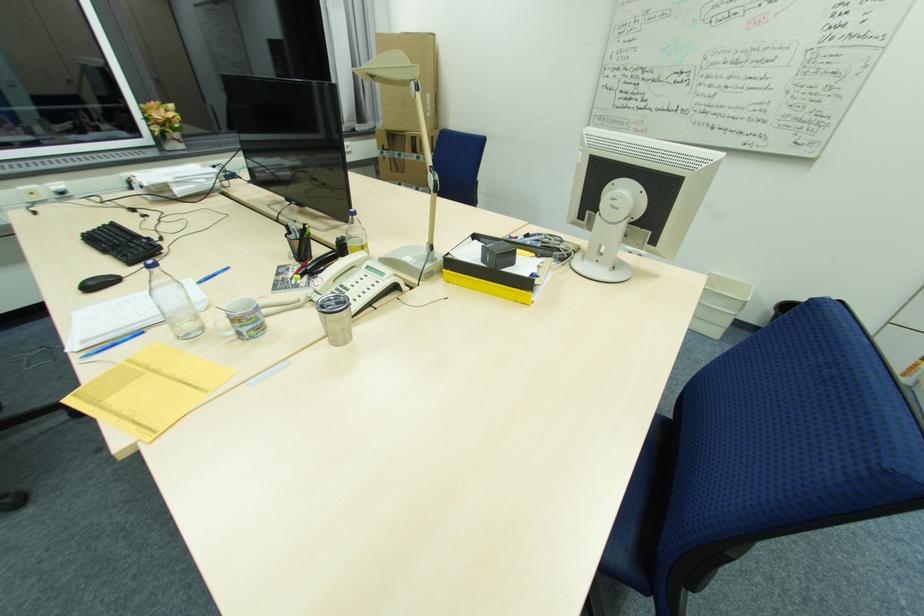
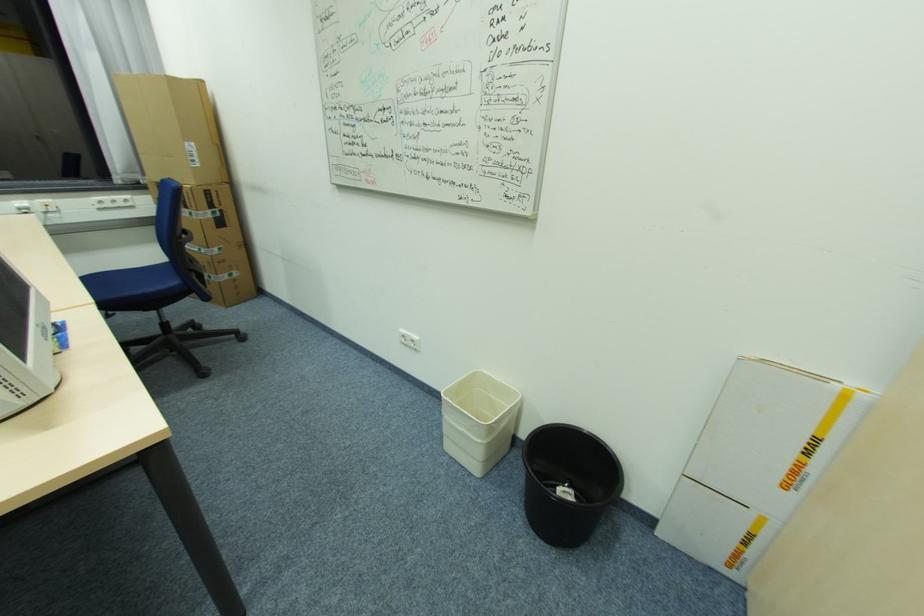
Locate, in the second image, the point that corresponds to (431,110) in the first image.

(200, 161)